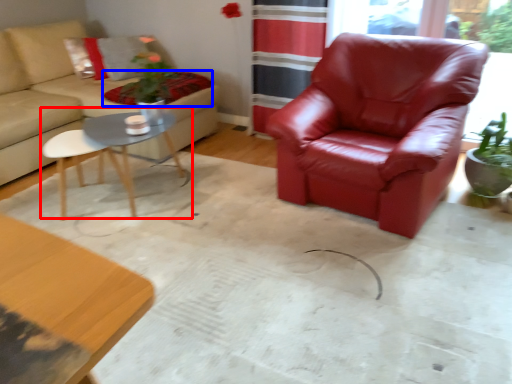
Question: Which of the following is the closest to the observer, coffee table (highlighted by a red box) or blanket (highlighted by a blue box)?

Choices:
 (A) coffee table
 (B) blanket

Answer: (A)